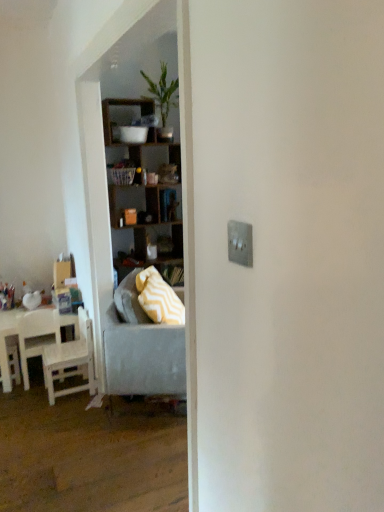
Question: Is point (165, 305) positioned closer to the camera than point (117, 176)?

Choices:
 (A) closer
 (B) farther

Answer: (A)

Question: In terms of size, does yellow zigzag fabric pillow at center appear bigger or smaller than plastic picnic basket at center?

Choices:
 (A) big
 (B) small

Answer: (A)

Question: Considering the real-world distances, which object is farthest from the wooden shelves at center?

Choices:
 (A) matte cardboard box at left
 (B) green leafy plant at upper center
 (C) plastic picnic basket at center
 (D) white matte chair at left, acting as the second chair starting from the right
 (E) white wood table at left

Answer: (D)

Question: Which object is the closest to the green leafy plant at upper center?

Choices:
 (A) matte cardboard box at left
 (B) wooden shelves at center
 (C) white wood table at left
 (D) yellow zigzag fabric pillow at center
 (E) gray fabric couch at center

Answer: (B)